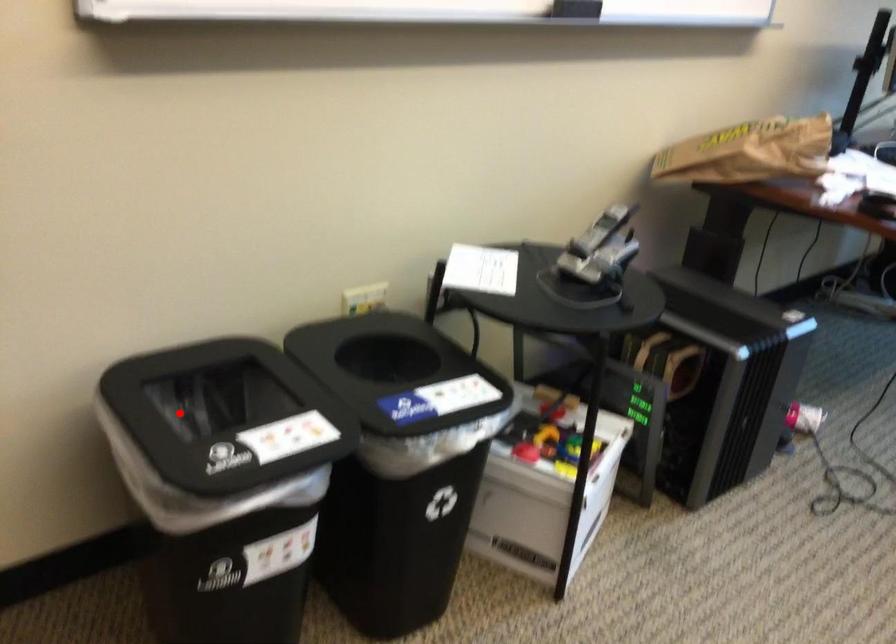
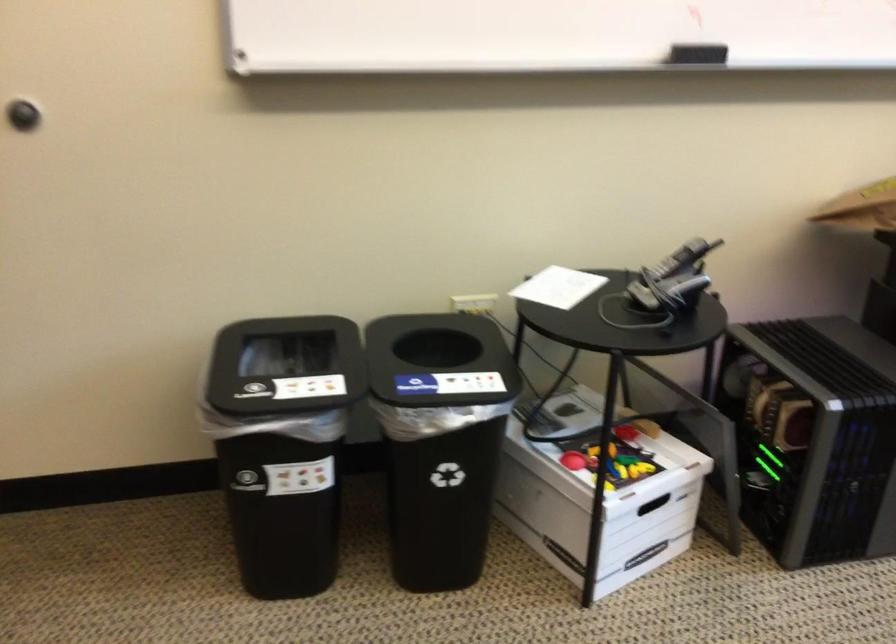
In the second image, find the point that corresponds to the highlighted location in the first image.

(286, 366)